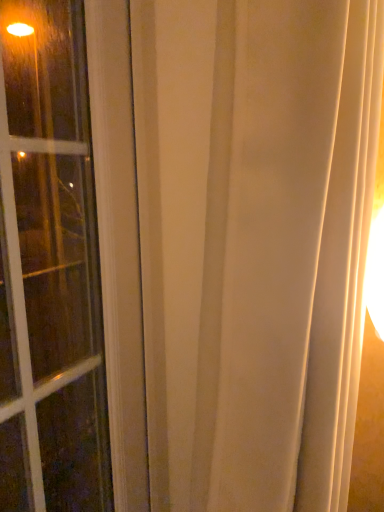
Image resolution: width=384 pixels, height=512 pixels. What are the coordinates of `clear glass window at left` in the screenshot? It's located at (49, 269).

Measure the distance between clear glass window at left and camera.

clear glass window at left is 22.82 inches from camera.

Image resolution: width=384 pixels, height=512 pixels. What do you see at coordinates (49, 269) in the screenshot?
I see `clear glass window at left` at bounding box center [49, 269].

Identify the location of clear glass window at left. The height and width of the screenshot is (512, 384). (49, 269).